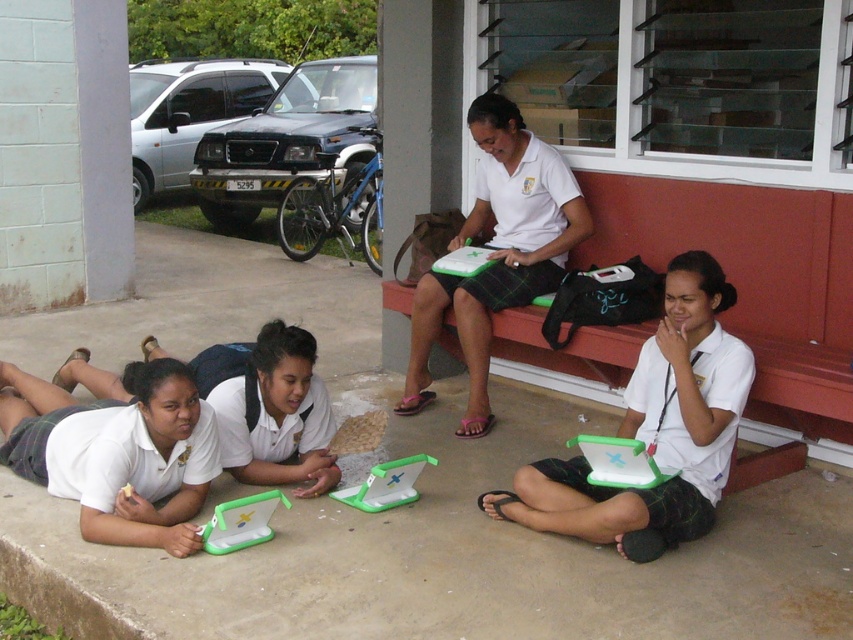
You are a student who wants to borrow a laptop for a short presentation. You see the matte white laptop at center and the matte green plastic laptop at lower left. Which one is more suitable for carrying around easily?

The matte white laptop at center is smaller than the matte green plastic laptop at lower left, so it is more suitable for carrying around easily.

You are a student who needs to choose between the matte green plastic laptop at lower left and the white matte laptop at center to work on a group project. Which laptop has a larger screen? Please explain your reasoning based on the scene.

The matte green plastic laptop at lower left has a larger screen than the white matte laptop at center because its width surpasses the white one, as described.

You are standing in the school courtyard and want to walk from point A to point B. Point A is at coordinates point (106, 540) and point B is at coordinates point (558, 154). Which point should you reach first to get closer to your destination?

You should reach point A at coordinates point (106, 540) first because it is closer to you than point B at coordinates point (558, 154).